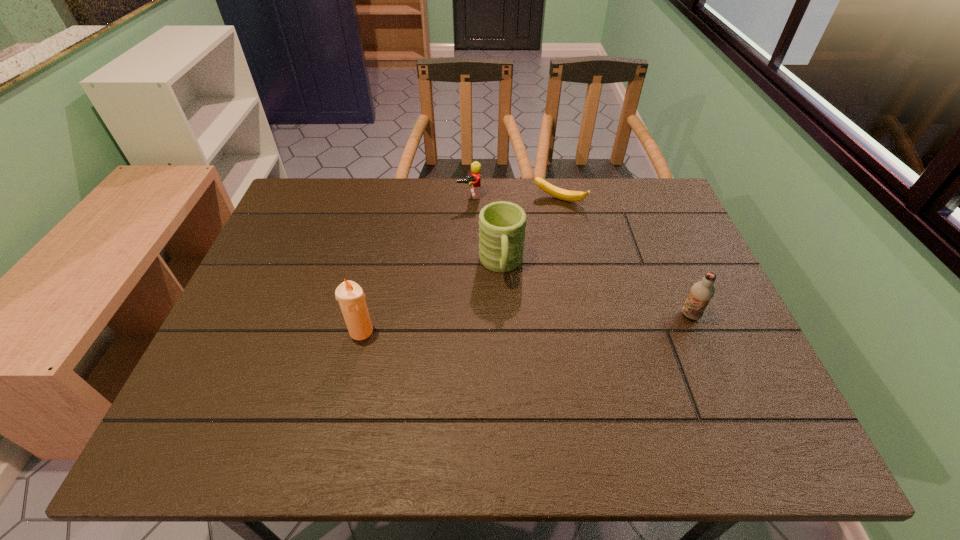
This screenshot has height=540, width=960. What are the coordinates of `the leftmost object` in the screenshot? It's located at (351, 298).

This screenshot has height=540, width=960. In order to click on the tallest object in this screenshot , I will do `click(351, 298)`.

What are the coordinates of `chocolate milk` in the screenshot? It's located at (701, 292).

Where is `the shortest object`? This screenshot has width=960, height=540. the shortest object is located at coordinates (573, 196).

Locate an element on the screen. The height and width of the screenshot is (540, 960). banana is located at coordinates (573, 196).

Locate an element on the screen. mug is located at coordinates (502, 224).

At what (x,y) coordinates should I click in order to perform the action: click on Lego. Please return your answer as a coordinate pair (x, y). Looking at the image, I should click on coord(474,180).

You are a GUI agent. You are given a task and a screenshot of the screen. Output one action in this format:
    pyautogui.click(x=<x>, y=<y>)
    Task: Click on the free space located 0.260m on the right of the candle
    The image size is (960, 540).
    Given the screenshot: What is the action you would take?
    pyautogui.click(x=485, y=331)

Identify the location of vacant area situated on the left of the rightmost object. (617, 315).

You are a GUI agent. You are given a task and a screenshot of the screen. Output one action in this format:
    pyautogui.click(x=<x>, y=<y>)
    Task: Click on the free space located 0.190m at the stem of the banana
    This screenshot has height=540, width=960.
    Given the screenshot: What is the action you would take?
    pyautogui.click(x=533, y=247)